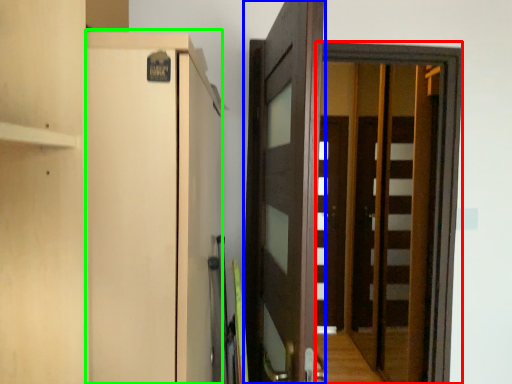
Question: Which object is the closest to the screen door (highlighted by a red box)? Choose among these: door (highlighted by a blue box) or cabinetry (highlighted by a green box).

Choices:
 (A) door
 (B) cabinetry

Answer: (A)